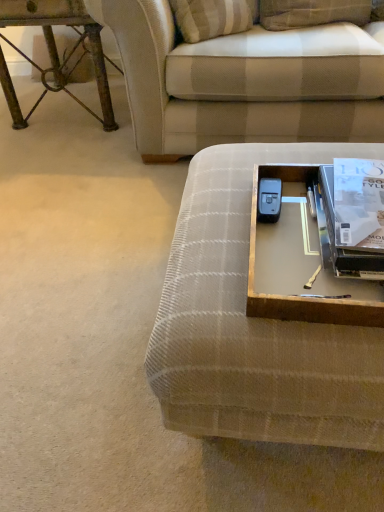
Question: From a real-world perspective, is metallic silver tray at lower right physically below plaid fabric couch at upper center, which ranks as the 1th studio couch in back-to-front order?

Choices:
 (A) yes
 (B) no

Answer: (B)

Question: Is metallic silver tray at lower right positioned with its back to plaid fabric couch at upper center, which is counted as the first studio couch, starting from the top?

Choices:
 (A) no
 (B) yes

Answer: (B)

Question: Would you consider metallic silver tray at lower right to be distant from plaid fabric couch at upper center, acting as the second studio couch starting from the front?

Choices:
 (A) yes
 (B) no

Answer: (B)

Question: Considering the relative positions of metallic silver tray at lower right and plaid fabric couch at upper center, which ranks as the 1th studio couch in back-to-front order, in the image provided, is metallic silver tray at lower right to the left of plaid fabric couch at upper center, which ranks as the 1th studio couch in back-to-front order, from the viewer's perspective?

Choices:
 (A) yes
 (B) no

Answer: (A)

Question: Is metallic silver tray at lower right further to camera compared to plaid fabric couch at upper center, which is counted as the second studio couch, starting from the bottom?

Choices:
 (A) no
 (B) yes

Answer: (A)

Question: Based on their sizes in the image, would you say rusty metal table at upper left is bigger or smaller than plaid fabric couch at upper center, which is counted as the first studio couch, starting from the top?

Choices:
 (A) small
 (B) big

Answer: (A)

Question: From a real-world perspective, is rusty metal table at upper left positioned above or below plaid fabric couch at upper center, which is counted as the second studio couch, starting from the bottom?

Choices:
 (A) above
 (B) below

Answer: (B)

Question: From the image's perspective, is rusty metal table at upper left located above or below plaid fabric couch at upper center, which ranks as the 1th studio couch in back-to-front order?

Choices:
 (A) below
 (B) above

Answer: (B)

Question: From their relative heights in the image, would you say rusty metal table at upper left is taller or shorter than plaid fabric couch at upper center, acting as the second studio couch starting from the front?

Choices:
 (A) short
 (B) tall

Answer: (A)

Question: From the image's perspective, is rusty metal table at upper left located above or below plaid fabric studio couch at center, the 1th studio couch when ordered from front to back?

Choices:
 (A) below
 (B) above

Answer: (B)

Question: From their relative heights in the image, would you say rusty metal table at upper left is taller or shorter than plaid fabric studio couch at center, the 1th studio couch when ordered from front to back?

Choices:
 (A) tall
 (B) short

Answer: (A)

Question: Is point [x=91, y=111] closer or farther from the camera than point [x=362, y=424]?

Choices:
 (A) closer
 (B) farther

Answer: (B)

Question: Do you think rusty metal table at upper left is within plaid fabric studio couch at center, placed as the second studio couch when sorted from back to front, or outside of it?

Choices:
 (A) outside
 (B) inside

Answer: (A)

Question: Based on their sizes in the image, would you say rusty metal table at upper left is bigger or smaller than metallic silver tray at lower right?

Choices:
 (A) big
 (B) small

Answer: (A)

Question: Relative to metallic silver tray at lower right, is rusty metal table at upper left in front or behind?

Choices:
 (A) behind
 (B) front

Answer: (A)